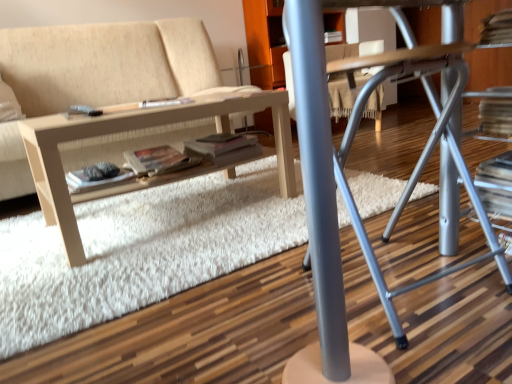
Question: Is point (381, 69) closer or farther from the camera than point (23, 165)?

Choices:
 (A) farther
 (B) closer

Answer: (B)

Question: In the image, is metallic gray computer desk at center positioned in front of or behind beige fabric couch at center?

Choices:
 (A) behind
 (B) front

Answer: (B)

Question: Considering the real-world distances, which object is farthest from the white shag rug at center?

Choices:
 (A) white matte paperback book at center, which is counted as the 2th paperback book, starting from the right
 (B) matte gray magazine at center
 (C) matte paper paperback book at center, the first paperback book viewed from the right
 (D) beige fabric couch at center
 (E) metallic gray computer desk at center

Answer: (D)

Question: Considering the real-world distances, which object is farthest from the matte paper paperback book at center, the second paperback book viewed from the left?

Choices:
 (A) white matte paperback book at center, positioned as the first paperback book in left-to-right order
 (B) matte gray magazine at center
 (C) light wood/texture table at lower left
 (D) metallic gray computer desk at center
 (E) white shag rug at center

Answer: (D)